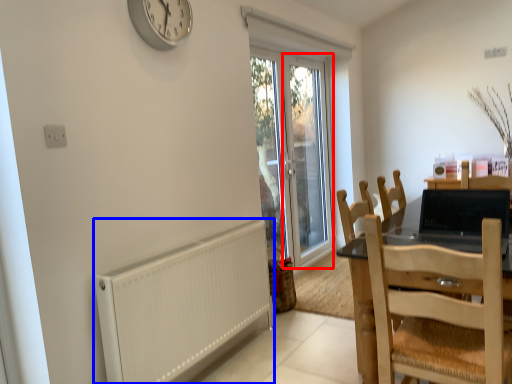
Question: Among these objects, which one is nearest to the camera, screen door (highlighted by a red box) or radiator (highlighted by a blue box)?

Choices:
 (A) screen door
 (B) radiator

Answer: (B)